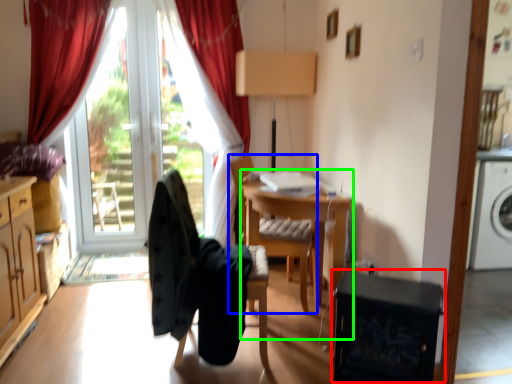
Question: Based on their relative distances, which object is nearer to dish washer (highlighted by a red box)? Choose from chair (highlighted by a blue box) and computer desk (highlighted by a green box).

Choices:
 (A) chair
 (B) computer desk

Answer: (B)